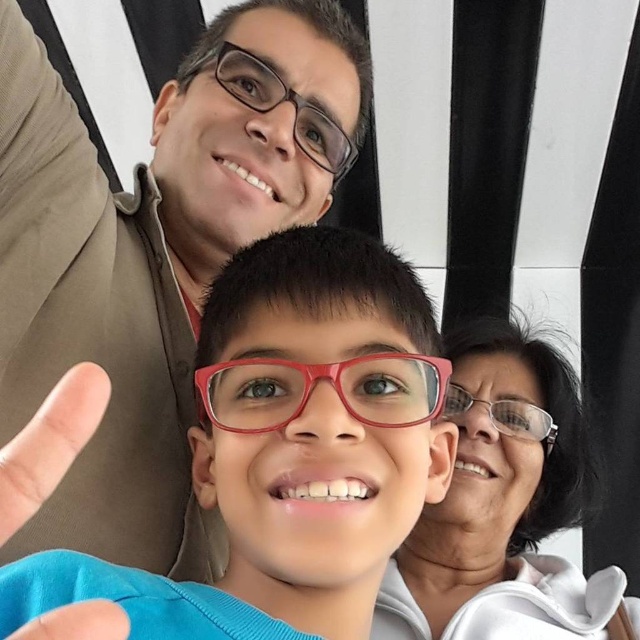
Can you confirm if matte brown shirt at upper left is thinner than transparent plastic glasses at upper center?

No, matte brown shirt at upper left is not thinner than transparent plastic glasses at upper center.

Does matte brown shirt at upper left have a greater width compared to transparent plastic glasses at upper center?

Correct, the width of matte brown shirt at upper left exceeds that of transparent plastic glasses at upper center.

Measure the distance between matte brown shirt at upper left and camera.

The distance of matte brown shirt at upper left from camera is 20.95 inches.

This screenshot has width=640, height=640. I want to click on matte brown shirt at upper left, so click(x=150, y=259).

Which is behind, point (97, 378) or point (109, 387)?

The point (109, 387) is behind.

Who is more forward, (19,621) or (1,504)?

Point (1,504) is more forward.

This screenshot has height=640, width=640. Find the location of `matte blue shirt at center`. matte blue shirt at center is located at coordinates (289, 449).

Which is below, matte brown shirt at upper left or matte red glasses at center?

matte red glasses at center

Which is behind, point (324, 177) or point (300, 410)?

The point (324, 177) is more distant.

Find the location of a particular element. matte brown shirt at upper left is located at coordinates (150, 259).